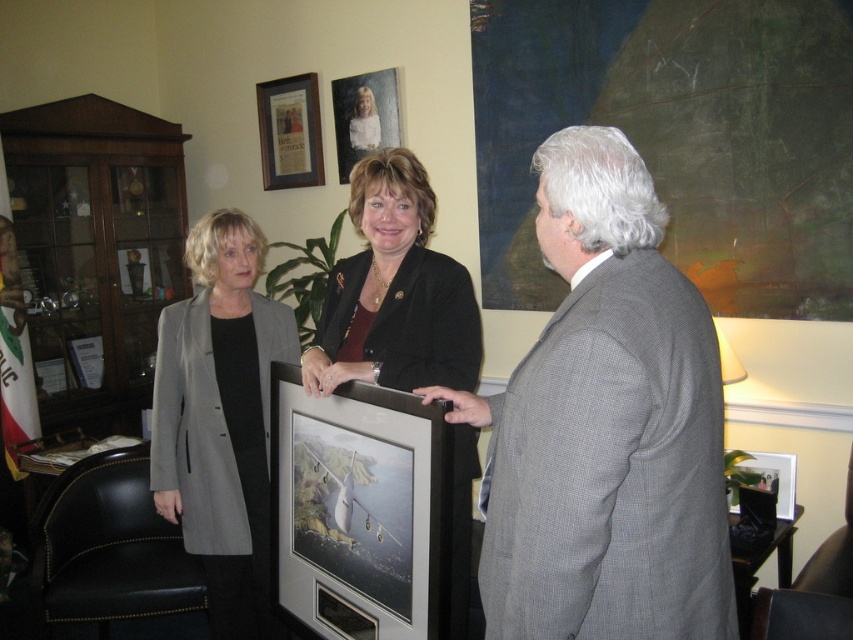
You are standing in the room and want to place a small decorative item exactly where the matte black blazer at center is located. What are the coordinates you should aim for?

The coordinates for the matte black blazer at center are at point (x=393, y=292), so you should aim for those coordinates.

Looking at this image, you are an event photographer at this presentation. You need to capture a photo where both the matte black blazer at center and the matte glass picture frame at upper center are clearly visible. Based on their positions, which object is closer to the camera?

The matte glass picture frame at upper center is closer to the camera because the matte black blazer at center is located below it, meaning the frame is positioned higher and thus nearer in the visual plane.

Consider the image. You are standing in the room and want to locate the matte black blazer at center. Where exactly is it positioned in the scene?

The matte black blazer at center is located at point coordinates of (393, 292).